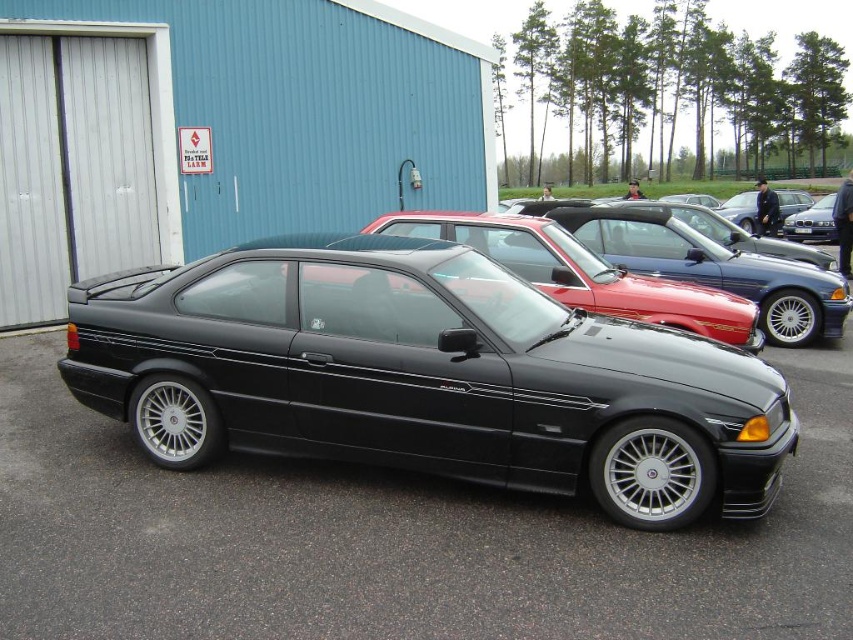
Question: Does glossy black sedan at center have a larger size compared to shiny metallic car at center?

Choices:
 (A) yes
 (B) no

Answer: (B)

Question: Which point appears farthest from the camera in this image?

Choices:
 (A) (811, 205)
 (B) (450, 282)
 (C) (751, 230)
 (D) (695, 310)

Answer: (A)

Question: Can you confirm if shiny metallic car at center is positioned to the left of satin black car at center?

Choices:
 (A) no
 (B) yes

Answer: (B)

Question: Which object is positioned closest to the shiny metallic car at center?

Choices:
 (A) satin black car at center
 (B) glossy black sedan at center

Answer: (A)

Question: Which object appears closest to the camera in this image?

Choices:
 (A) shiny metallic car at center
 (B) glossy black sedan at center
 (C) satin black car at center
 (D) glossy black car at center

Answer: (D)

Question: Can you confirm if glossy black car at center is positioned to the left of satin black car at center?

Choices:
 (A) no
 (B) yes

Answer: (B)